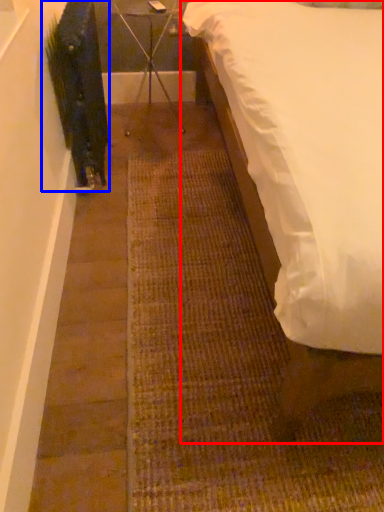
Question: Which object is closer to the camera taking this photo, bed (highlighted by a red box) or plant (highlighted by a blue box)?

Choices:
 (A) bed
 (B) plant

Answer: (A)